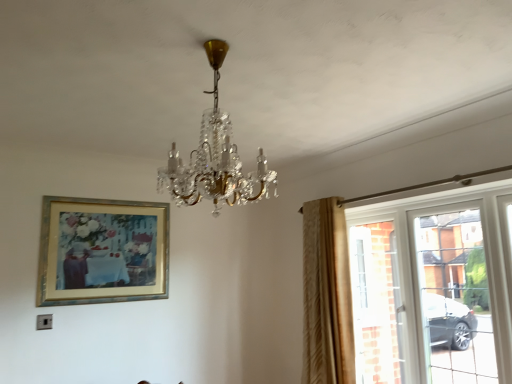
Locate an element on the screen. The width and height of the screenshot is (512, 384). crystal glass chandelier at center is located at coordinates (215, 158).

The image size is (512, 384). In order to click on clear glass window at right in this screenshot , I will do `click(434, 287)`.

Considering the points (324, 372) and (371, 382), which point is behind, point (324, 372) or point (371, 382)?

Point (371, 382)

Would you say beige textured curtain at right is to the left or to the right of clear glass window at right in the picture?

beige textured curtain at right is to the left of clear glass window at right.

Is beige textured curtain at right completely or partially outside of clear glass window at right?

Yes, beige textured curtain at right is located beyond the bounds of clear glass window at right.

Identify the location of window lying in front of the beige textured curtain at right. This screenshot has height=384, width=512. (434, 287).

Could you tell me if gold metallic picture frame at upper left is turned towards clear glass window at right?

No, gold metallic picture frame at upper left is not facing towards clear glass window at right.

Can you confirm if gold metallic picture frame at upper left is thinner than clear glass window at right?

Yes.

Choose the correct answer: Is gold metallic picture frame at upper left inside clear glass window at right or outside it?

gold metallic picture frame at upper left exists outside the volume of clear glass window at right.

Which is behind, point (41, 239) or point (407, 346)?

Point (41, 239)

Based on the photo, is crystal glass chandelier at center inside gold metallic picture frame at upper left?

No, crystal glass chandelier at center is not inside gold metallic picture frame at upper left.

Is crystal glass chandelier at center at the back of gold metallic picture frame at upper left?

No, crystal glass chandelier at center is not at the back of gold metallic picture frame at upper left.

Which is farther from the camera, [59,295] or [192,183]?

Point [59,295]

Which of these two, gold metallic picture frame at upper left or crystal glass chandelier at center, is wider?

crystal glass chandelier at center is wider.

Can clear glass window at right be found inside crystal glass chandelier at center?

No.

Is crystal glass chandelier at center at the left side of clear glass window at right?

Indeed, crystal glass chandelier at center is positioned on the left side of clear glass window at right.

Can you confirm if crystal glass chandelier at center is smaller than clear glass window at right?

Yes, crystal glass chandelier at center is smaller than clear glass window at right.

Identify the location of picture frame on the left side of crystal glass chandelier at center. (102, 251).

How many degrees apart are the facing directions of crystal glass chandelier at center and gold metallic picture frame at upper left?

89.9 degrees.

Does crystal glass chandelier at center come behind gold metallic picture frame at upper left?

No, the depth of crystal glass chandelier at center is less than that of gold metallic picture frame at upper left.

Could you measure the distance between crystal glass chandelier at center and gold metallic picture frame at upper left?

crystal glass chandelier at center is 5.28 feet away from gold metallic picture frame at upper left.

Could crystal glass chandelier at center be considered to be inside clear glass window at right?

No, crystal glass chandelier at center is not a part of clear glass window at right.

Can you confirm if clear glass window at right is smaller than crystal glass chandelier at center?

No, clear glass window at right is not smaller than crystal glass chandelier at center.

From the image's perspective, is clear glass window at right positioned above or below crystal glass chandelier at center?

Clearly, from the image's perspective, clear glass window at right is below crystal glass chandelier at center.

From the picture: Is clear glass window at right wider than crystal glass chandelier at center?

No.

Is clear glass window at right in contact with gold metallic picture frame at upper left?

No, clear glass window at right is not touching gold metallic picture frame at upper left.

Does clear glass window at right contain gold metallic picture frame at upper left?

No, gold metallic picture frame at upper left is located outside of clear glass window at right.

Is clear glass window at right oriented towards gold metallic picture frame at upper left?

No, clear glass window at right is not facing towards gold metallic picture frame at upper left.

Is point (383, 340) less distant than point (168, 268)?

No, it is not.

Locate an element on the screen. This screenshot has height=384, width=512. window in front of the beige textured curtain at right is located at coordinates (434, 287).

Image resolution: width=512 pixels, height=384 pixels. I want to click on window below the gold metallic picture frame at upper left (from the image's perspective), so click(x=434, y=287).

Estimate the real-world distances between objects in this image. Which object is closer to crystal glass chandelier at center, clear glass window at right or beige textured curtain at right?

beige textured curtain at right is closer to crystal glass chandelier at center.

Estimate the real-world distances between objects in this image. Which object is closer to clear glass window at right, gold metallic picture frame at upper left or beige textured curtain at right?

beige textured curtain at right.

From the picture: Looking at the image, which one is located closer to clear glass window at right, crystal glass chandelier at center or gold metallic picture frame at upper left?

crystal glass chandelier at center lies closer to clear glass window at right than the other object.

Which object lies further to the anchor point beige textured curtain at right, gold metallic picture frame at upper left or clear glass window at right?

gold metallic picture frame at upper left.

From the image, which object appears to be nearer to beige textured curtain at right, clear glass window at right or crystal glass chandelier at center?

The object closer to beige textured curtain at right is clear glass window at right.

Estimate the real-world distances between objects in this image. Which object is further from gold metallic picture frame at upper left, beige textured curtain at right or crystal glass chandelier at center?

Based on the image, crystal glass chandelier at center appears to be further to gold metallic picture frame at upper left.

From the image, which object appears to be nearer to gold metallic picture frame at upper left, crystal glass chandelier at center or beige textured curtain at right?

beige textured curtain at right.

When comparing their distances from beige textured curtain at right, does crystal glass chandelier at center or clear glass window at right seem further?

Among the two, crystal glass chandelier at center is located further to beige textured curtain at right.

Locate an element on the screen. The width and height of the screenshot is (512, 384). window between crystal glass chandelier at center and beige textured curtain at right from front to back is located at coordinates (434, 287).

Identify the location of lamp between gold metallic picture frame at upper left and clear glass window at right. This screenshot has width=512, height=384. (215, 158).

Locate an element on the screen. This screenshot has width=512, height=384. curtain located between gold metallic picture frame at upper left and clear glass window at right in the left-right direction is located at coordinates (326, 295).

At what (x,y) coordinates should I click in order to perform the action: click on curtain positioned between crystal glass chandelier at center and gold metallic picture frame at upper left from near to far. Please return your answer as a coordinate pair (x, y). The image size is (512, 384). Looking at the image, I should click on (326, 295).